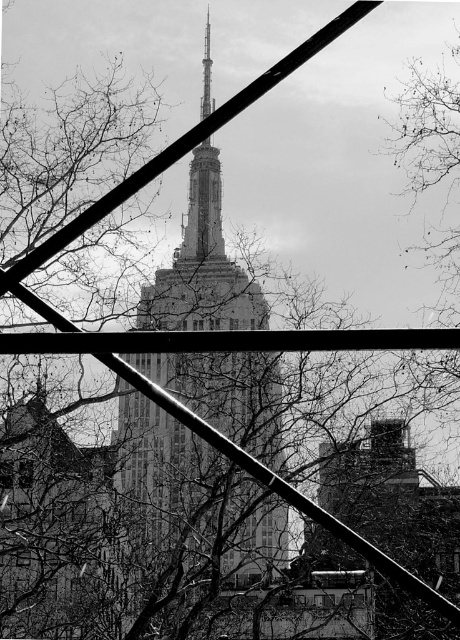
You are standing in front of the Empire State Building and see two points marked on the scaffolding in the foreground. The first point is at coordinates point [28,461] and the second is at point [325,593]. Which point is closer to your eyes?

Point [28,461] is closer to your eyes because it is further to the viewer than point [325,593].

In the scene shown: You are an architect analyzing the Empire State Building photo. You notice two transparent glass windows in the lower section of the image. Which of the two, the transparent glass window at lower left or the transparent glass window at lower center, has a bigger area?

The transparent glass window at lower left is larger in size than the transparent glass window at lower center, so the transparent glass window at lower left has a bigger area.